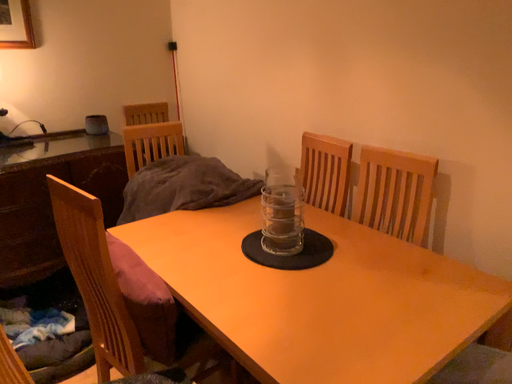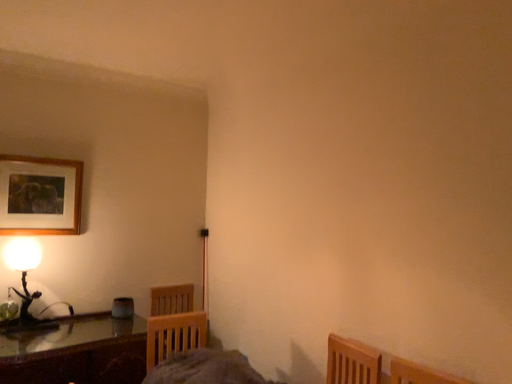
Question: How did the camera likely rotate when shooting the video?

Choices:
 (A) rotated downward
 (B) rotated upward

Answer: (B)